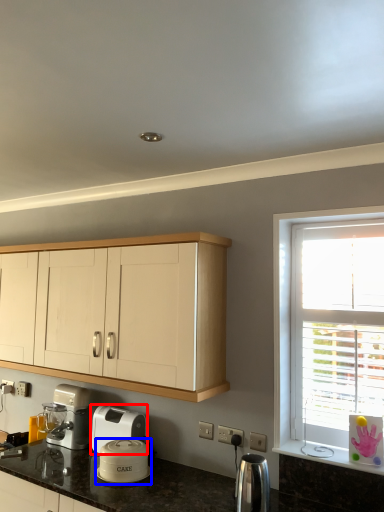
Question: Which of the following is the closest to the observer, home appliance (highlighted by a red box) or kitchen appliance (highlighted by a blue box)?

Choices:
 (A) home appliance
 (B) kitchen appliance

Answer: (B)